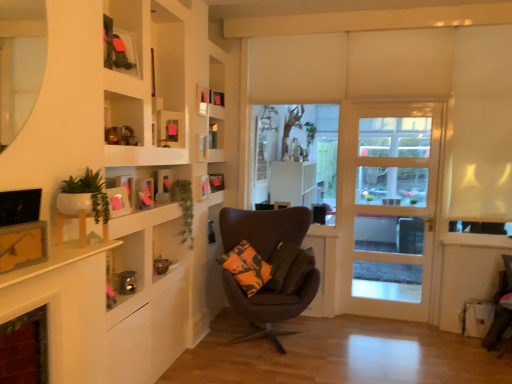
Question: Is pink matte picture frame at upper center, arranged as the 4th picture frame when viewed from the front, spatially inside white glass door at center, or outside of it?

Choices:
 (A) inside
 (B) outside

Answer: (B)

Question: Does point 143,180 appear closer or farther from the camera than point 385,244?

Choices:
 (A) farther
 (B) closer

Answer: (B)

Question: Which of these objects is positioned farthest from the pink matte picture frame at center-left, placed as the sixth picture frame when sorted from back to front?

Choices:
 (A) dark brown fabric chair at center, the second chair from the right
 (B) matte white picture frame at upper center, positioned as the seventh picture frame in front-to-back order
 (C) matte black picture frame at upper center, acting as the 2th picture frame starting from the back
 (D) green leafy plant at upper left, placed as the 2th plant when sorted from front to back
 (E) matte yellow picture frame at left, which appears as the eleventh picture frame when viewed from the back

Answer: (E)

Question: Considering the real-world distances, which object is farthest from the white matte planter at left, acting as the 2th plant starting from the back?

Choices:
 (A) wooden shelves at upper left
 (B) matte yellow picture frame at left, which ranks as the 1th picture frame in front-to-back order
 (C) orange patterned pillow at center
 (D) pink matte picture frame at upper left, positioned as the third picture frame in front-to-back order
 (E) velvet dark brown chair at lower right, placed as the second chair when sorted from left to right

Answer: (E)